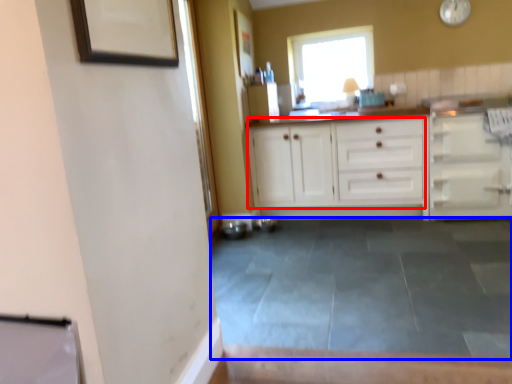
Question: Which point is closer to the camera, cabinetry (highlighted by a red box) or concrete (highlighted by a blue box)?

Choices:
 (A) cabinetry
 (B) concrete

Answer: (B)